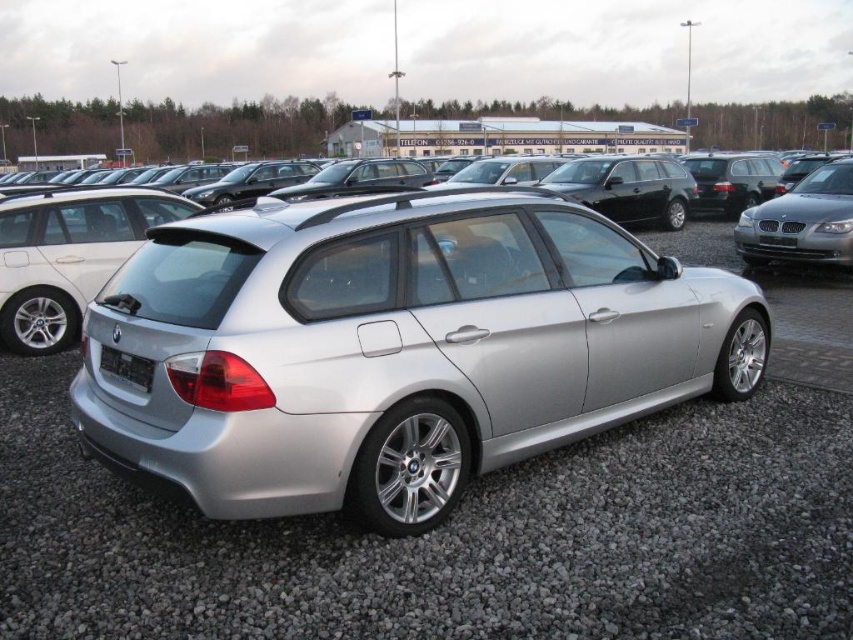
Question: Does silver metallic sedan at center come behind silver gravel at center?

Choices:
 (A) no
 (B) yes

Answer: (B)

Question: Among these points, which one is farthest from the camera?

Choices:
 (A) (579, 600)
 (B) (138, 372)
 (C) (349, 486)
 (D) (0, 314)

Answer: (D)

Question: Which of the following is the farthest from the observer?

Choices:
 (A) black plastic license plate at rear
 (B) satin silver car at right

Answer: (B)

Question: Does satin silver sedan at center appear under satin black sedan at center?

Choices:
 (A) no
 (B) yes

Answer: (B)

Question: Can you confirm if silver metallic sedan at center is wider than satin silver car at right?

Choices:
 (A) yes
 (B) no

Answer: (A)

Question: Among these objects, which one is nearest to the camera?

Choices:
 (A) satin silver sedan at center
 (B) silver metallic sedan at center
 (C) satin silver car at right
 (D) black plastic license plate at rear

Answer: (B)